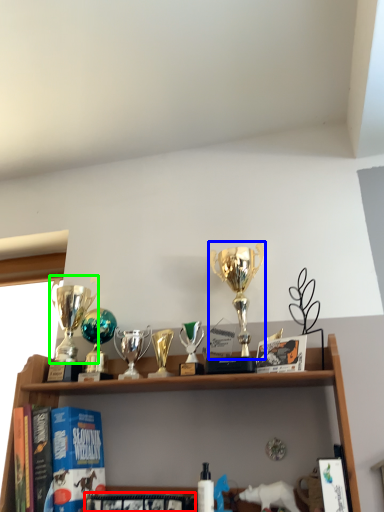
Question: Estimate the real-world distances between objects in this image. Which object is closer to book (highlighted by a red box), trophy (highlighted by a blue box) or trophy (highlighted by a green box)?

Choices:
 (A) trophy
 (B) trophy

Answer: (B)